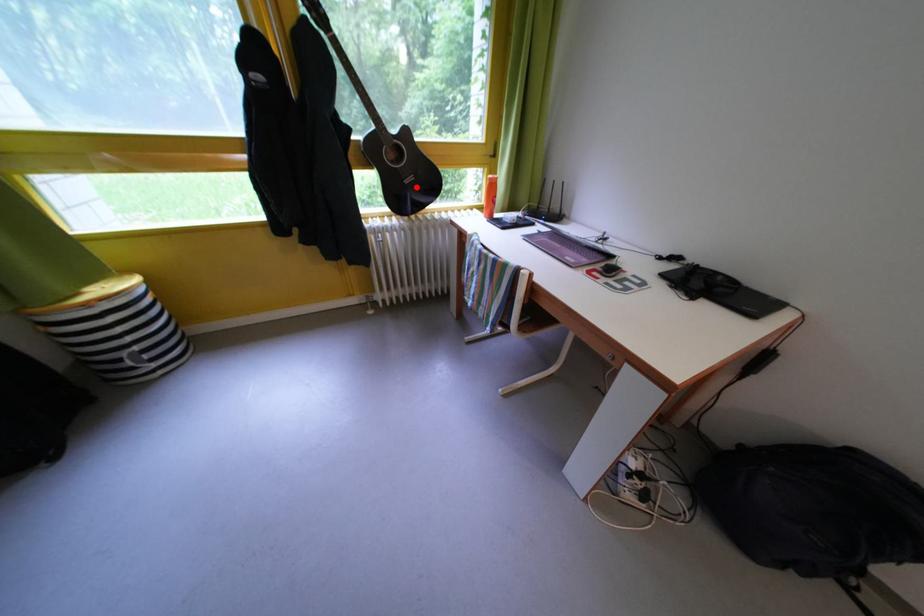
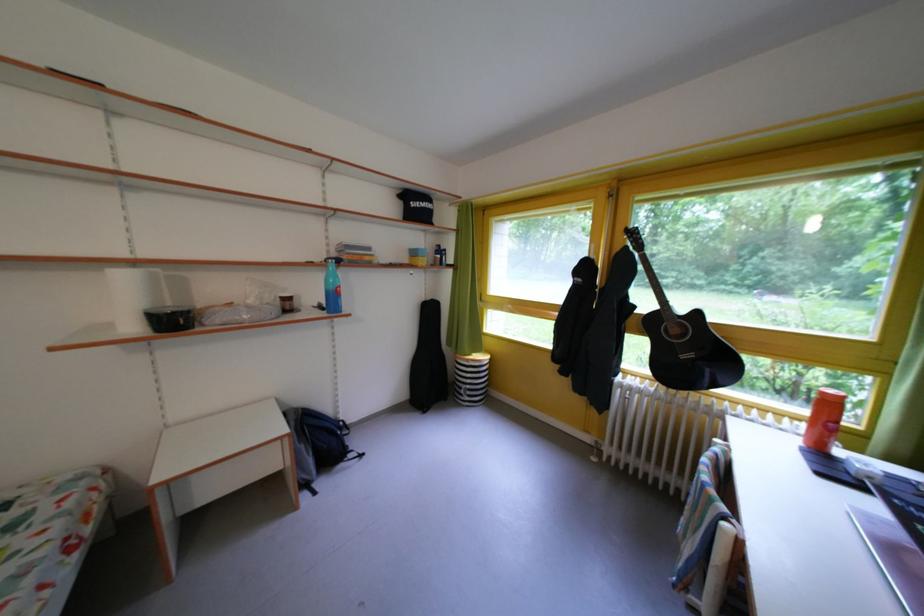
Question: I am providing you with two images of the same scene from different viewpoints. In image1, a red point is highlighted. Considering the same 3D point in image2, which of the following is correct?

Choices:
 (A) It is closer
 (B) It is farther

Answer: (B)